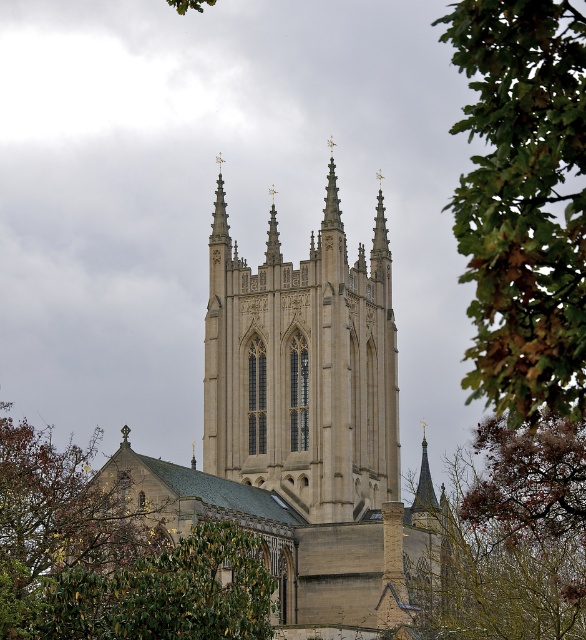
You are an architect analyzing the church facade. Based on the image, which object has a greater width between the green leafy tree at upper right and the brown textured leaves at lower right?

The green leafy tree at upper right has a greater width than the brown textured leaves at lower right.